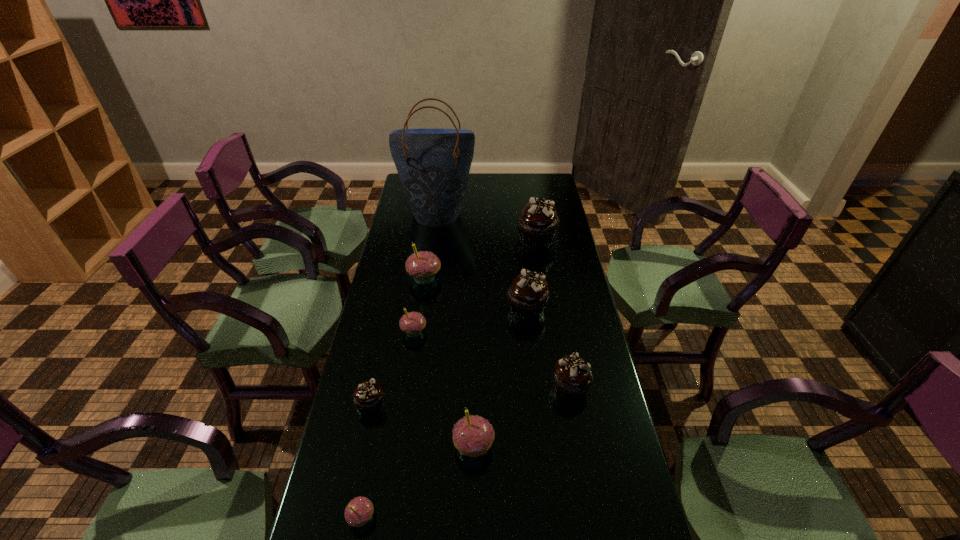
Find the location of `blue shopping bag`. blue shopping bag is located at coordinates (433, 165).

Identify the location of the tallest object. The image size is (960, 540). (433, 165).

What are the coordinates of `the farthest cupcake` in the screenshot? It's located at (537, 224).

This screenshot has width=960, height=540. I want to click on the eighth nearest object, so click(537, 224).

I want to click on the farthest pink cupcake, so click(x=422, y=265).

Image resolution: width=960 pixels, height=540 pixels. I want to click on the seventh nearest object, so click(x=422, y=265).

Find the location of a particular element. Image resolution: width=960 pixels, height=540 pixels. the third nearest brown cupcake is located at coordinates (528, 294).

Where is `the rightmost pink cupcake`? the rightmost pink cupcake is located at coordinates (473, 435).

The width and height of the screenshot is (960, 540). I want to click on the eighth farthest object, so click(473, 435).

The height and width of the screenshot is (540, 960). Find the location of `the third biggest pink cupcake`. the third biggest pink cupcake is located at coordinates (412, 323).